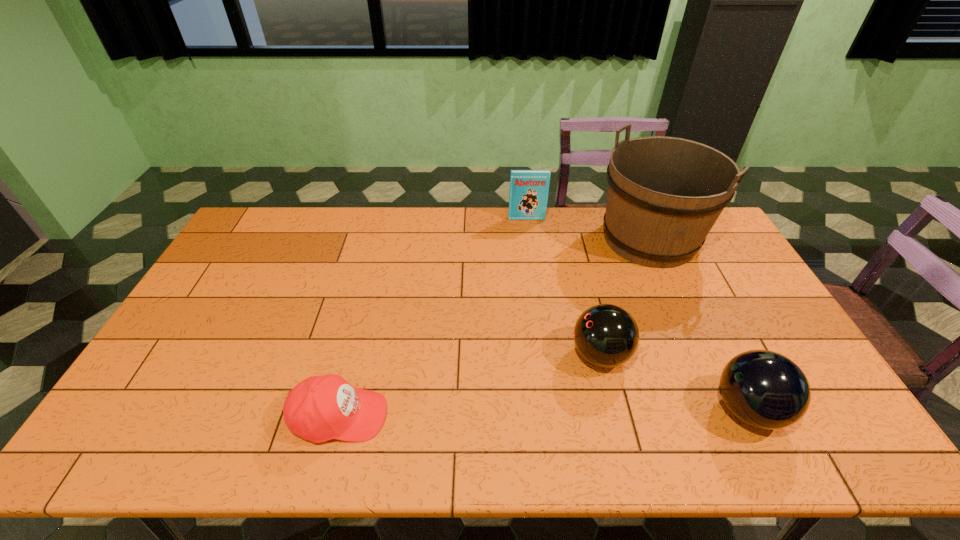
Locate an element on the screen. This screenshot has height=540, width=960. vacant point located on the side of the right bowling ball with the finger holes is located at coordinates (582, 409).

I want to click on vacant space located on the surface of the left bowling ball near the finger holes, so click(x=479, y=355).

Find the location of a particular element. The height and width of the screenshot is (540, 960). free spot located 0.100m on the surface of the left bowling ball near the finger holes is located at coordinates (534, 355).

In order to click on free spot located 0.340m on the surface of the left bowling ball near the finger holes in this screenshot , I will do `click(446, 355)`.

Image resolution: width=960 pixels, height=540 pixels. What are the coordinates of `blank area located on the front panel of the shortest object` in the screenshot? It's located at (490, 416).

Where is `bucket at the far edge`? The width and height of the screenshot is (960, 540). bucket at the far edge is located at coordinates (664, 194).

Find the location of a particular element. book positioned at the far edge is located at coordinates tap(528, 196).

Identify the location of bowling ball at the near edge. (764, 389).

Image resolution: width=960 pixels, height=540 pixels. What are the coordinates of `baseball cap present at the near edge` in the screenshot? It's located at (320, 408).

At what (x,y) coordinates should I click in order to perform the action: click on bucket that is at the right edge. Please return your answer as a coordinate pair (x, y). The height and width of the screenshot is (540, 960). Looking at the image, I should click on (664, 194).